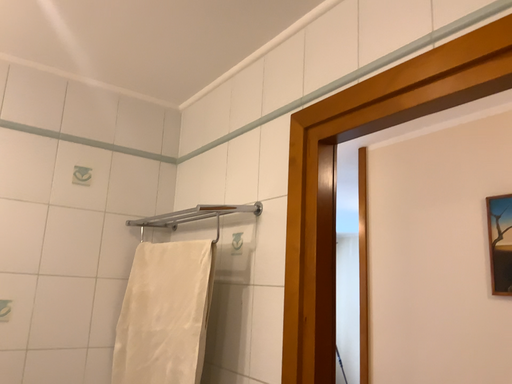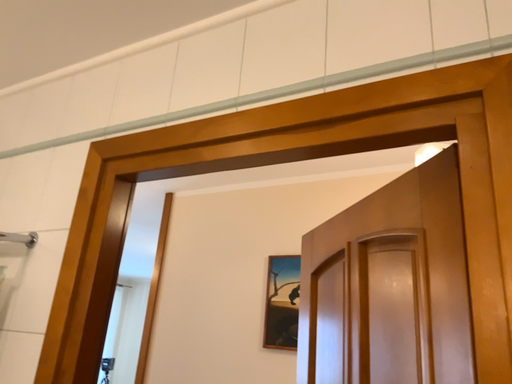
Question: Which way did the camera rotate in the video?

Choices:
 (A) rotated right
 (B) rotated left

Answer: (A)